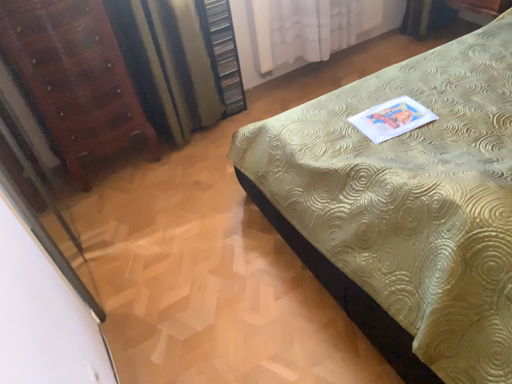
You are a GUI agent. You are given a task and a screenshot of the screen. Output one action in this format:
    pyautogui.click(x=<x>, y=<y>)
    Task: Click on the free spot in front of striped fabric curtain at left, positioned as the 2th curtain in right-to-left order
    This screenshot has width=512, height=384.
    Given the screenshot: What is the action you would take?
    pyautogui.click(x=178, y=176)